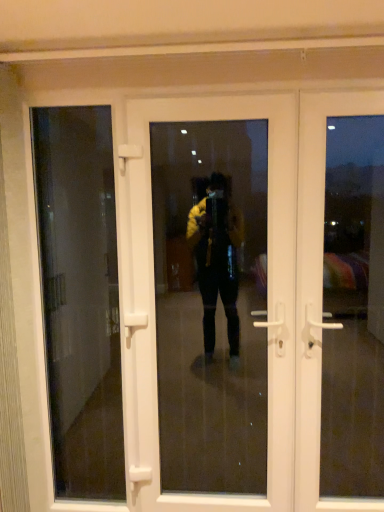
Question: Does transparent glass door at left appear on the left side of white plastic door at center, the 1th door in the left-to-right sequence?

Choices:
 (A) no
 (B) yes

Answer: (B)

Question: Is the position of transparent glass door at left more distant than that of white plastic door at center, the 2th door positioned from the right?

Choices:
 (A) no
 (B) yes

Answer: (B)

Question: Can you confirm if transparent glass door at left is smaller than white plastic door at center, the 1th door in the left-to-right sequence?

Choices:
 (A) no
 (B) yes

Answer: (B)

Question: Would you consider transparent glass door at left to be distant from white plastic door at center, the 1th door in the left-to-right sequence?

Choices:
 (A) yes
 (B) no

Answer: (A)

Question: Does transparent glass door at left turn towards white plastic door at center, the 1th door in the left-to-right sequence?

Choices:
 (A) yes
 (B) no

Answer: (B)

Question: From a real-world perspective, is transparent glass door at left physically below white plastic door at center, the 1th door in the left-to-right sequence?

Choices:
 (A) no
 (B) yes

Answer: (B)

Question: Can you confirm if white plastic door at right, the first door when ordered from right to left, is bigger than transparent glass door at left?

Choices:
 (A) yes
 (B) no

Answer: (A)

Question: From the image's perspective, is white plastic door at right, which is the second door from left to right, above transparent glass door at left?

Choices:
 (A) yes
 (B) no

Answer: (A)

Question: Can you confirm if white plastic door at right, which is the second door from left to right, is positioned to the left of transparent glass door at left?

Choices:
 (A) no
 (B) yes

Answer: (A)

Question: Is white plastic door at right, the first door when ordered from right to left, aimed at transparent glass door at left?

Choices:
 (A) no
 (B) yes

Answer: (A)

Question: Does white plastic door at right, the first door when ordered from right to left, have a lesser height compared to transparent glass door at left?

Choices:
 (A) no
 (B) yes

Answer: (B)

Question: From a real-world perspective, is white plastic door at right, which is the second door from left to right, positioned over transparent glass door at left based on gravity?

Choices:
 (A) no
 (B) yes

Answer: (B)

Question: From the image's perspective, is white plastic door at center, the 1th door in the left-to-right sequence, below white plastic door at right, which is the second door from left to right?

Choices:
 (A) no
 (B) yes

Answer: (B)